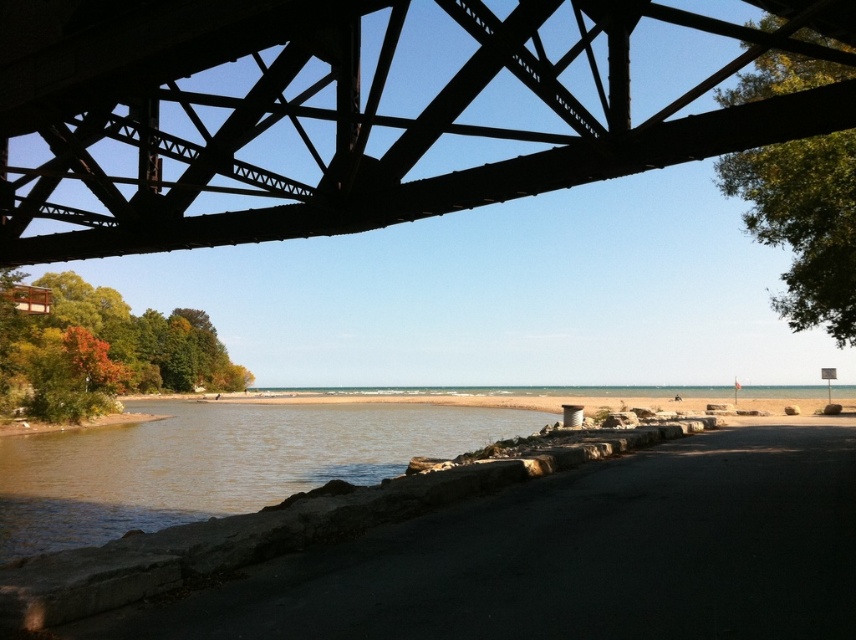
Question: Which object is farther from the camera taking this photo?

Choices:
 (A) brown stone river at lower left
 (B) black steel bridge at upper center

Answer: (A)

Question: Can you confirm if black steel bridge at upper center is positioned to the right of brown stone river at lower left?

Choices:
 (A) no
 (B) yes

Answer: (B)

Question: Is black steel bridge at upper center positioned in front of brown stone river at lower left?

Choices:
 (A) no
 (B) yes

Answer: (B)

Question: Does black steel bridge at upper center have a larger size compared to brown stone river at lower left?

Choices:
 (A) no
 (B) yes

Answer: (A)

Question: Which of the following is the farthest from the observer?

Choices:
 (A) (437, 100)
 (B) (277, 429)

Answer: (B)